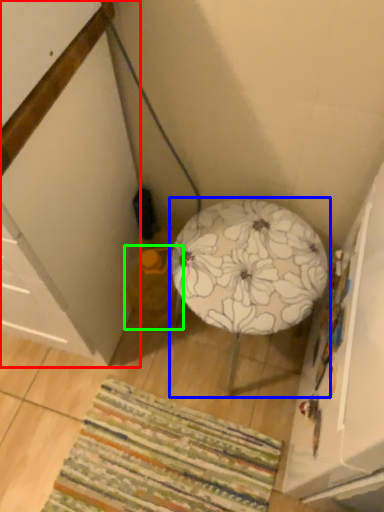
Question: Which is nearer to the cabinetry (highlighted by a red box)? furniture (highlighted by a blue box) or bean bag chair (highlighted by a green box).

Choices:
 (A) furniture
 (B) bean bag chair

Answer: (B)